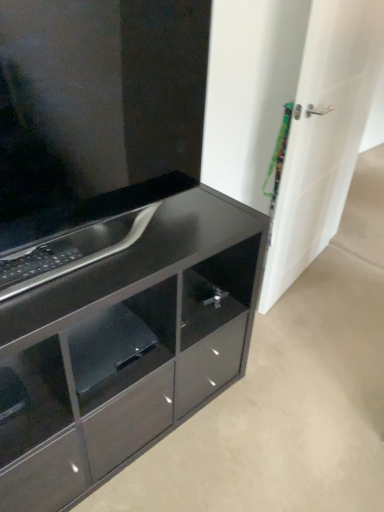
The height and width of the screenshot is (512, 384). What are the coordinates of `glossy black shelf at lower center` in the screenshot? It's located at (123, 344).

At what (x,y) coordinates should I click in order to perform the action: click on glossy black cabinet at center. Please return your answer as a coordinate pair (x, y). The image size is (384, 512). Looking at the image, I should click on (97, 106).

From a real-world perspective, which is physically below, glossy black shelf at lower center or glossy black cabinet at lower left?

glossy black cabinet at lower left is physically lower.

How distant is glossy black shelf at lower center from glossy black cabinet at lower left?

A distance of 5.07 inches exists between glossy black shelf at lower center and glossy black cabinet at lower left.

Is glossy black shelf at lower center facing away from glossy black cabinet at lower left?

Absolutely, glossy black shelf at lower center is directed away from glossy black cabinet at lower left.

Would you consider white glossy door at right to be distant from glossy black cabinet at lower left?

They are positioned close to each other.

Could you tell me if white glossy door at right is facing glossy black cabinet at lower left?

No, white glossy door at right is not oriented towards glossy black cabinet at lower left.

From the image's perspective, which one is positioned higher, white glossy door at right or glossy black cabinet at lower left?

From the image's view, white glossy door at right is above.

Considering the positions of points (344, 178) and (65, 396), is point (344, 178) closer to camera compared to point (65, 396)?

No, it is behind (65, 396).

This screenshot has height=512, width=384. I want to click on door on the right of glossy black cabinet at center, so click(323, 135).

Considering the positions of objects glossy black cabinet at center and white glossy door at right in the image provided, who is in front, glossy black cabinet at center or white glossy door at right?

glossy black cabinet at center is more forward.

From the image's perspective, which is above, glossy black cabinet at center or white glossy door at right?

white glossy door at right.

How many degrees apart are the facing directions of glossy black cabinet at center and white glossy door at right?

12 degrees.

Looking at this image, would you say glossy black shelf at lower center is part of white glossy door at right's contents?

No, glossy black shelf at lower center is not inside white glossy door at right.

Who is smaller, white glossy door at right or glossy black shelf at lower center?

glossy black shelf at lower center is smaller.

Is white glossy door at right closer to camera compared to glossy black shelf at lower center?

No, white glossy door at right is further to the viewer.

Could you tell me if glossy black cabinet at lower left is facing white glossy door at right?

No, glossy black cabinet at lower left is not turned towards white glossy door at right.

What's the angular difference between glossy black cabinet at lower left and white glossy door at right's facing directions?

11.6 degrees separate the facing orientations of glossy black cabinet at lower left and white glossy door at right.

From a real-world perspective, is glossy black cabinet at lower left positioned above or below white glossy door at right?

glossy black cabinet at lower left is below white glossy door at right.

Is glossy black cabinet at lower left directly adjacent to white glossy door at right?

No, glossy black cabinet at lower left is not next to white glossy door at right.

From the image's perspective, between glossy black cabinet at center and glossy black shelf at lower center, who is located below?

glossy black shelf at lower center appears lower in the image.

Consider the image. Would you consider glossy black cabinet at center to be distant from glossy black shelf at lower center?

glossy black cabinet at center is actually quite close to glossy black shelf at lower center.

Is glossy black cabinet at center behind glossy black shelf at lower center?

No, glossy black cabinet at center is closer to the camera.

From their relative heights in the image, would you say glossy black cabinet at center is taller or shorter than glossy black shelf at lower center?

glossy black cabinet at center is taller than glossy black shelf at lower center.

From the image's perspective, relative to white glossy door at right, is glossy black shelf at lower center above or below?

Clearly, from the image's perspective, glossy black shelf at lower center is below white glossy door at right.

Would you consider glossy black shelf at lower center to be distant from white glossy door at right?

Indeed, glossy black shelf at lower center is not near white glossy door at right.

Can you confirm if glossy black shelf at lower center is positioned to the right of white glossy door at right?

No, glossy black shelf at lower center is not to the right of white glossy door at right.

Does glossy black shelf at lower center have a larger size compared to white glossy door at right?

No.

At what (x,y) coordinates should I click in order to perform the action: click on shelf that is below the glossy black cabinet at lower left (from the image's perspective). Please return your answer as a coordinate pair (x, y). Looking at the image, I should click on (123, 344).

This screenshot has width=384, height=512. I want to click on door behind the glossy black cabinet at lower left, so click(323, 135).

Looking at the image, which one is located closer to glossy black cabinet at center, white glossy door at right or glossy black cabinet at lower left?

glossy black cabinet at lower left is positioned closer to the anchor glossy black cabinet at center.

Based on their spatial positions, is glossy black cabinet at center or white glossy door at right closer to glossy black shelf at lower center?

glossy black cabinet at center.

Estimate the real-world distances between objects in this image. Which object is further from glossy black cabinet at center, glossy black cabinet at lower left or white glossy door at right?

white glossy door at right.

Based on their spatial positions, is glossy black shelf at lower center or glossy black cabinet at center further from white glossy door at right?

Among the two, glossy black shelf at lower center is located further to white glossy door at right.

Which object lies further to the anchor point white glossy door at right, glossy black cabinet at lower left or glossy black cabinet at center?

Among the two, glossy black cabinet at center is located further to white glossy door at right.

Considering their positions, is glossy black cabinet at center positioned closer to glossy black cabinet at lower left than glossy black shelf at lower center?

→ glossy black shelf at lower center lies closer to glossy black cabinet at lower left than the other object.

Based on their spatial positions, is glossy black cabinet at center or glossy black shelf at lower center further from white glossy door at right?

glossy black shelf at lower center lies further to white glossy door at right than the other object.

From the image, which object appears to be farther from glossy black cabinet at center, glossy black shelf at lower center or glossy black cabinet at lower left?

glossy black shelf at lower center is further to glossy black cabinet at center.

Where is `cabinetry located between glossy black cabinet at lower left and white glossy door at right in the left-right direction`? The width and height of the screenshot is (384, 512). cabinetry located between glossy black cabinet at lower left and white glossy door at right in the left-right direction is located at coordinates (97, 106).

Find the location of `cabinetry between glossy black shelf at lower center and white glossy door at right from left to right`. cabinetry between glossy black shelf at lower center and white glossy door at right from left to right is located at coordinates (97, 106).

Locate an element on the screen. This screenshot has height=512, width=384. chest of drawers between glossy black cabinet at center and glossy black shelf at lower center in the up-down direction is located at coordinates (124, 339).

The image size is (384, 512). What are the coordinates of `the chest of drawers located between glossy black shelf at lower center and white glossy door at right in the left-right direction` in the screenshot? It's located at (124, 339).